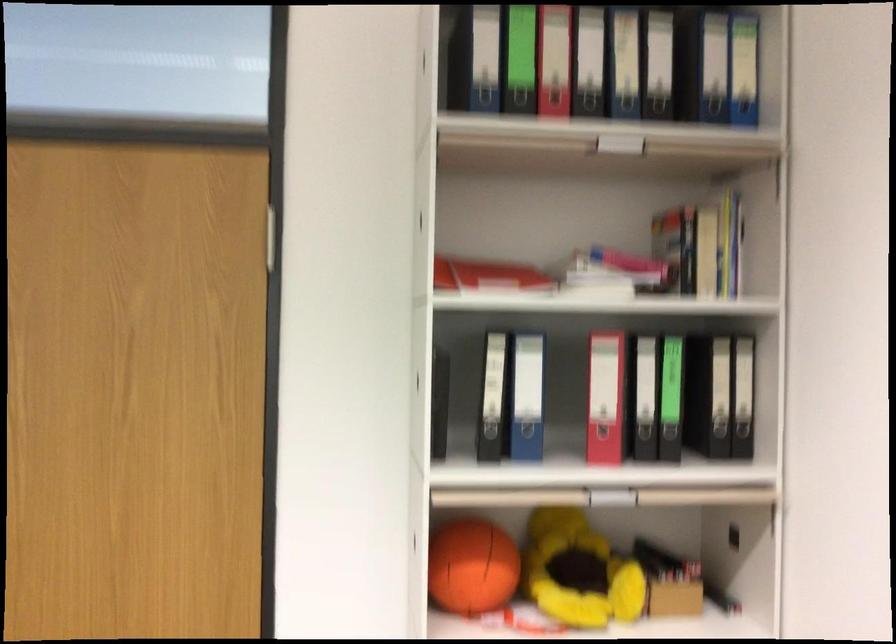
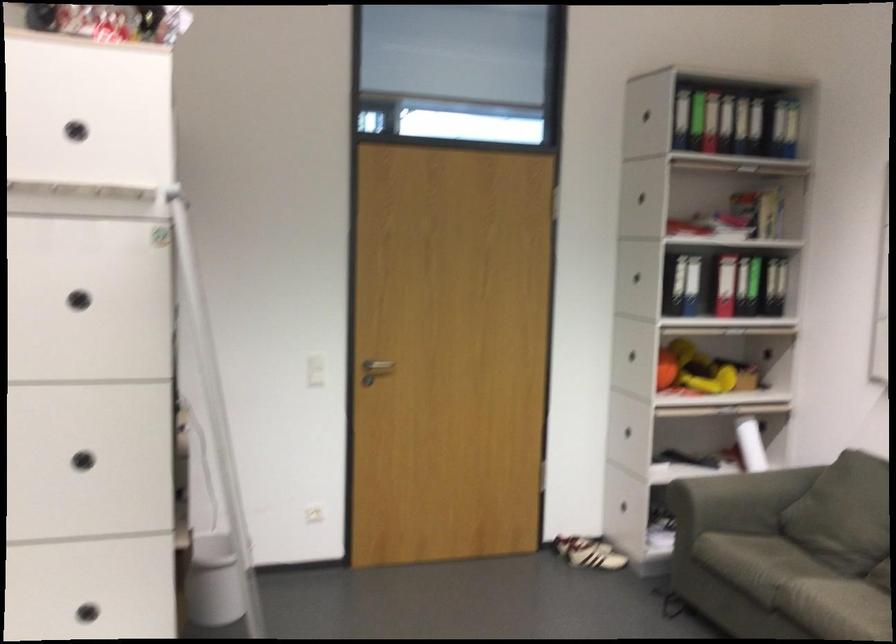
The point at (718, 419) is marked in the first image. Where is the corresponding point in the second image?

(773, 286)